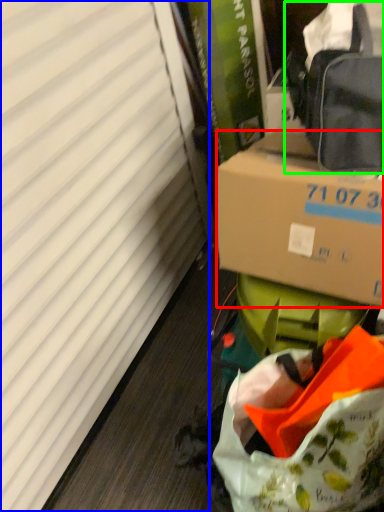
Question: Which object is the closest to the box (highlighted by a red box)? Choose among these: curtain (highlighted by a blue box) or pack (highlighted by a green box).

Choices:
 (A) curtain
 (B) pack

Answer: (B)